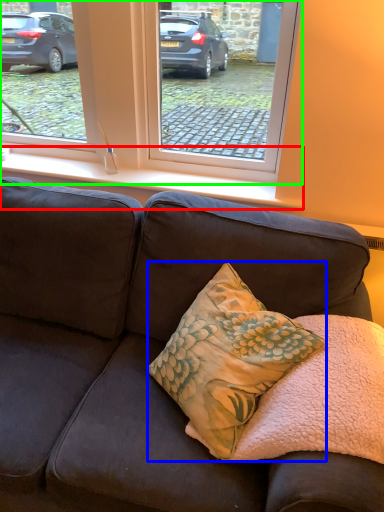
Question: Which object is the farthest from window sill (highlighted by a red box)? Choose among these: pillow (highlighted by a blue box) or window (highlighted by a green box).

Choices:
 (A) pillow
 (B) window

Answer: (A)